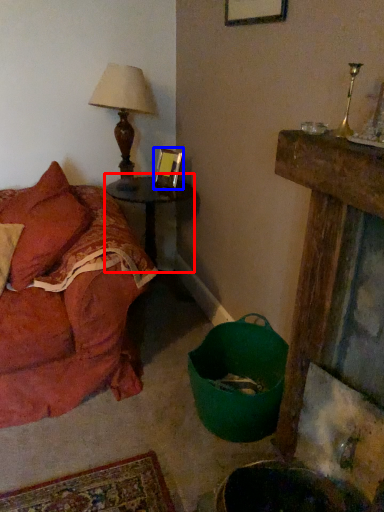
Question: Which object appears farthest to the camera in this image, table (highlighted by a red box) or picture frame (highlighted by a blue box)?

Choices:
 (A) table
 (B) picture frame

Answer: (B)